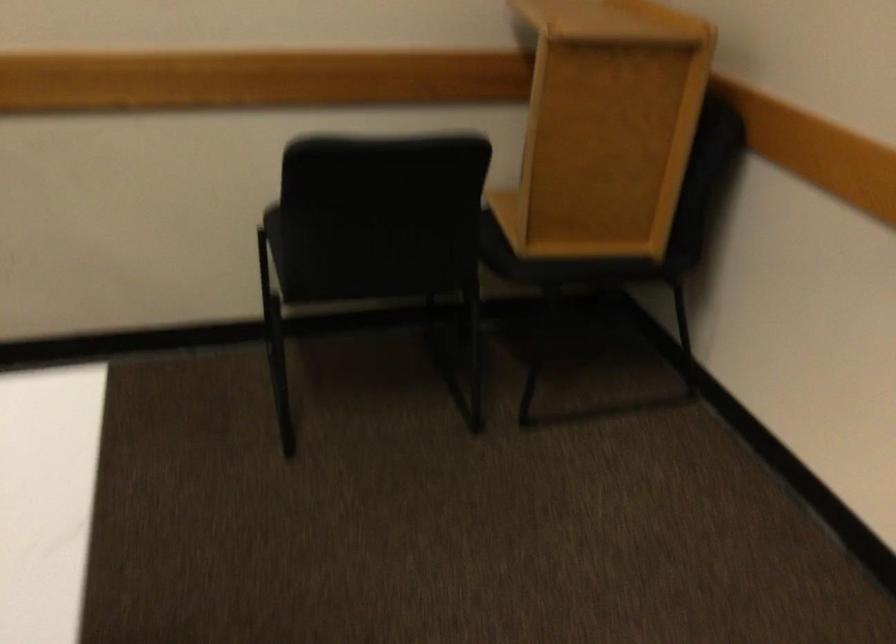
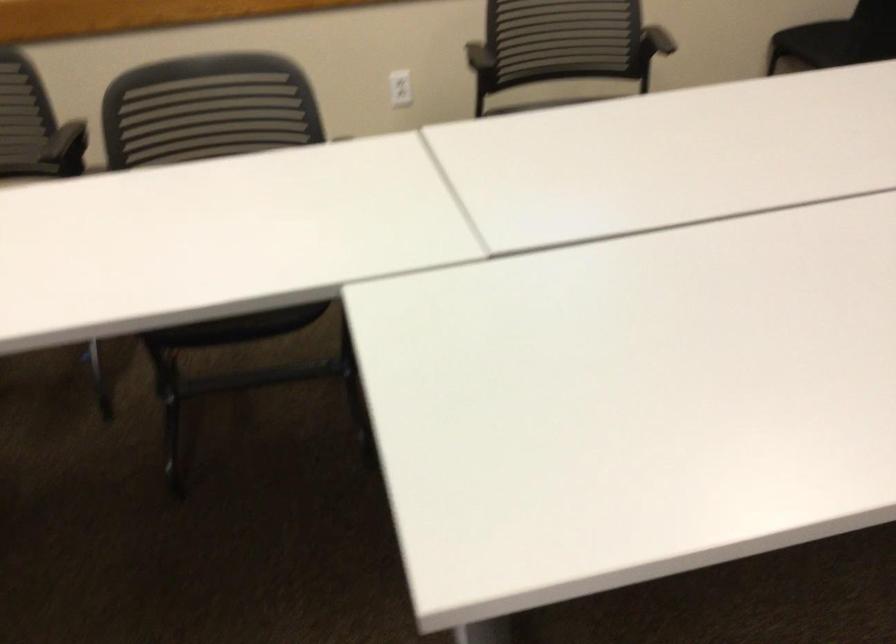
Where in the second image is the point corresponding to the point at 99,212 from the first image?

(676, 43)